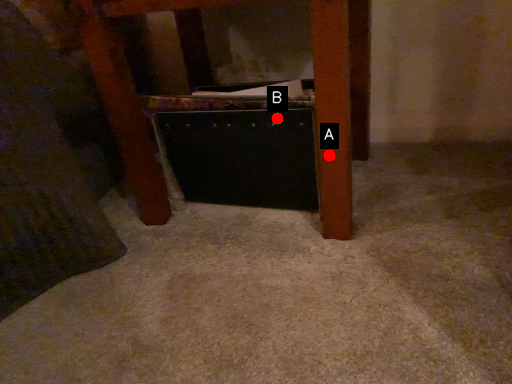
Question: Two points are circled on the image, labeled by A and B beside each circle. Which of the following is the farthest from the observer?

Choices:
 (A) A is further
 (B) B is further

Answer: (B)